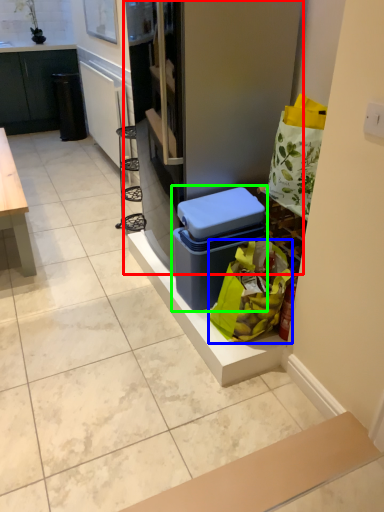
Question: Considering the real-world distances, which object is closest to fridge (highlighted by a red box)? shopping bag (highlighted by a blue box) or storage box (highlighted by a green box).

Choices:
 (A) shopping bag
 (B) storage box

Answer: (B)